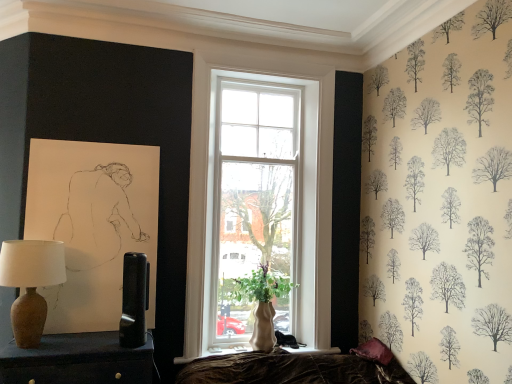
The width and height of the screenshot is (512, 384). In order to click on vacant space underneath matte black table lamp at center, the second table lamp from the left (from a real-world perspective) in this screenshot , I will do `click(132, 351)`.